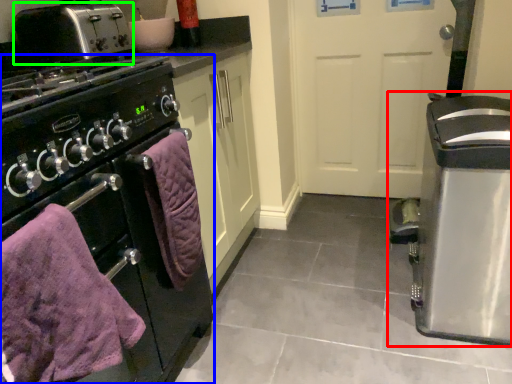
Question: Which object is positioned closest to kitchen appliance (highlighted by a red box)? Select from home appliance (highlighted by a blue box) and toaster (highlighted by a green box).

Choices:
 (A) home appliance
 (B) toaster

Answer: (A)